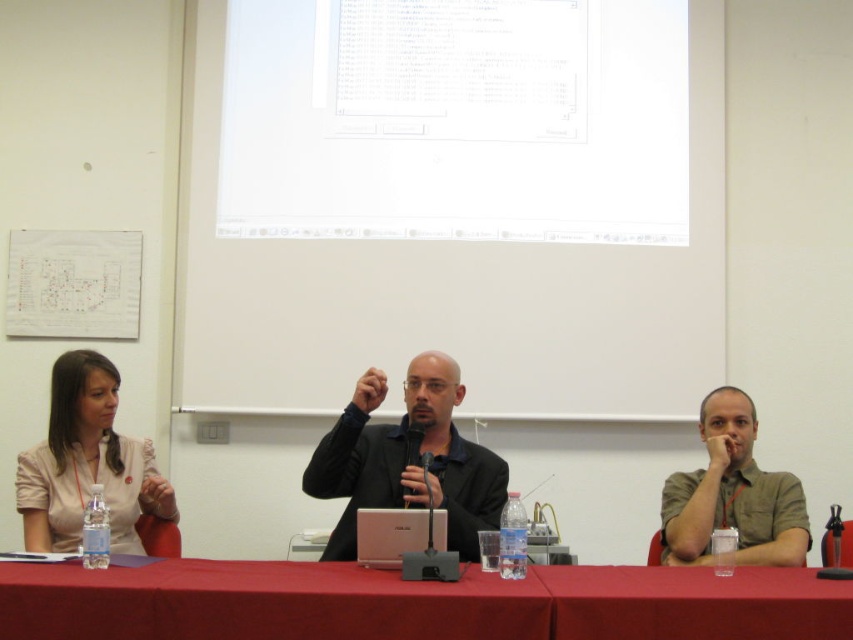
The width and height of the screenshot is (853, 640). In order to click on green cotton shirt at center in this screenshot , I will do `click(732, 493)`.

Between green cotton shirt at center and silver metallic laptop at center, which one appears on the left side from the viewer's perspective?

From the viewer's perspective, silver metallic laptop at center appears more on the left side.

Between point (805, 520) and point (380, 566), which one is positioned in front?

Positioned in front is point (380, 566).

The image size is (853, 640). Identify the location of green cotton shirt at center. (732, 493).

Does point (759, 496) come behind point (407, 502)?

That is True.

Between green cotton shirt at center and black plastic microphone at center, which one has more height?

With more height is green cotton shirt at center.

Who is more distant from viewer, (795, 486) or (412, 448)?

The point (795, 486) is behind.

Identify the location of green cotton shirt at center. The height and width of the screenshot is (640, 853). (732, 493).

Which is above, matte pink blouse at left or green cotton shirt at center?

matte pink blouse at left is higher up.

Based on the photo, who is taller, matte pink blouse at left or green cotton shirt at center?

With more height is matte pink blouse at left.

Where is `matte pink blouse at left`? The width and height of the screenshot is (853, 640). matte pink blouse at left is located at coordinates (88, 465).

This screenshot has width=853, height=640. Identify the location of matte pink blouse at left. (88, 465).